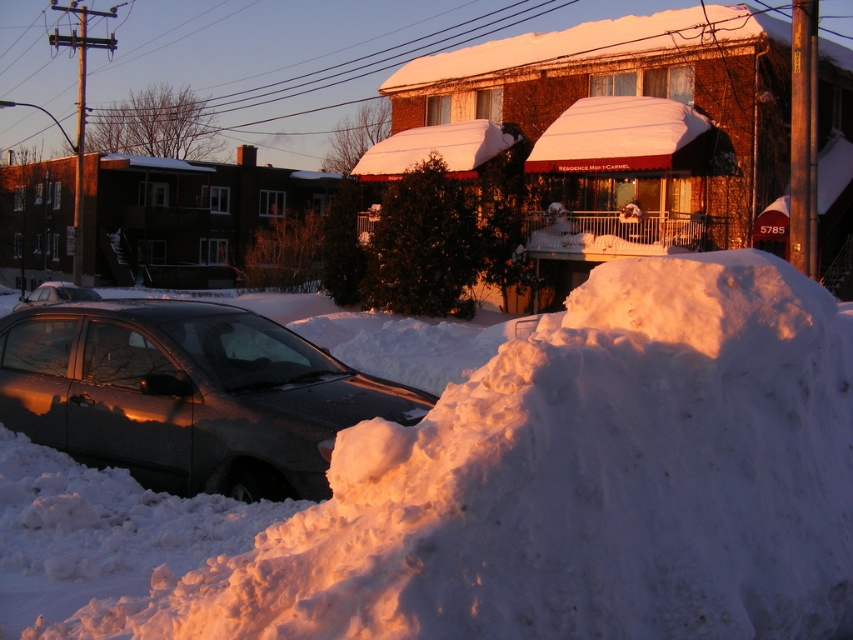
You are standing in the winter scene and want to move from the shiny black car at left to the satin black car at lower left. Which direction should you walk to reach it?

You should walk to the right to reach the satin black car at lower left because it is positioned to the right of the shiny black car at left.

You are standing at point A, which is at coordinate point (10,310), and you want to walk to point B, which is at coordinate point (148,396). According to the scene description, which direction should you move relative to your current position?

You should move forward because point (148,396) is in front of point (10,310).

You are standing in the winter scene and want to take a photo of the shiny black car at left without the white fluffy snow at lower left blocking the view. Can you move to a position where the car is visible without the snow in front of it?

The white fluffy snow at lower left is closer to the viewer than the shiny black car at left. Since the snow is in front of the car from your current position, moving to a different angle might allow you to see the car without the snow blocking it. However, without additional information about the terrain or obstacles, it is uncertain if such a position exists.